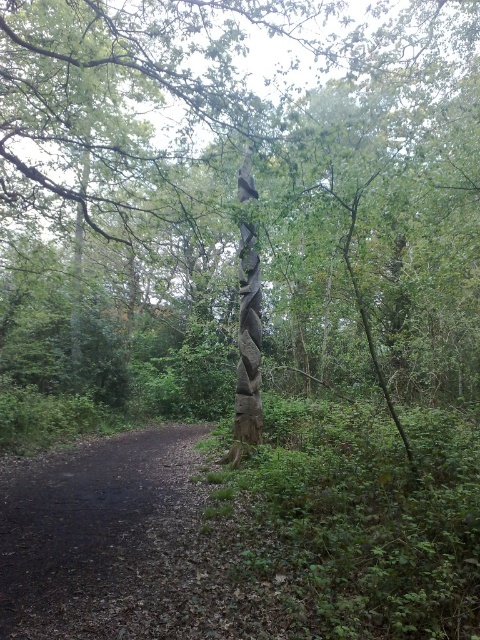
Does carved wooden totem pole at center have a larger size compared to dirt/gravel path at lower left?

Correct, carved wooden totem pole at center is larger in size than dirt/gravel path at lower left.

Who is more forward, (48,289) or (108,499)?

Positioned in front is point (108,499).

The width and height of the screenshot is (480, 640). Identify the location of carved wooden totem pole at center. (238, 204).

Who is more forward, (23,582) or (245,400)?

Point (23,582) is more forward.

Between dirt/gravel path at lower left and carved wood totem pole at center, which one has less height?

Standing shorter between the two is dirt/gravel path at lower left.

Which is in front, point (108, 595) or point (252, 260)?

Positioned in front is point (108, 595).

At what (x,y) coordinates should I click in order to perform the action: click on dirt/gravel path at lower left. Please return your answer as a coordinate pair (x, y). This screenshot has width=480, height=640. Looking at the image, I should click on (96, 536).

Is point (299, 237) closer to viewer compared to point (261, 440)?

Yes, point (299, 237) is in front of point (261, 440).

Between point (0, 259) and point (249, 403), which one is positioned in front?

Point (249, 403)

Identify the location of carved wooden totem pole at center. (238, 204).